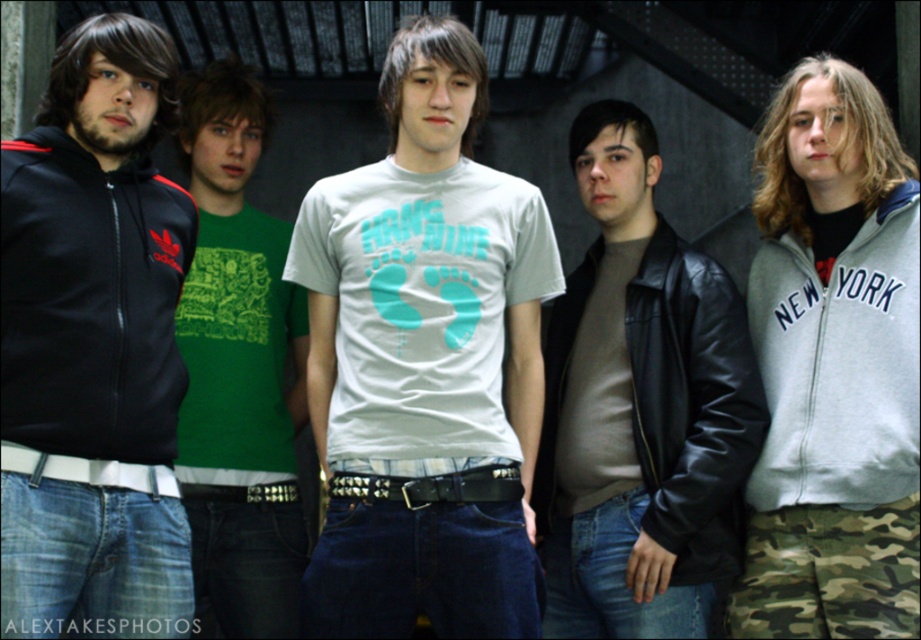
What is located at the coordinates point (92, 346)?

The point (92, 346) is occupied by the matte black hoodie at left.

You are standing in the industrial setting and see the point at coordinates (x=581, y=188). Is this point within a 30 meter safety zone from your current position?

The point at coordinates (x=581, y=188) is 31.76 meters away from the viewer, so it is outside the 30 meter safety zone.

You are observing a group of people in an industrial setting. You notice two items of clothing, the matte black hoodie at left and the black leather jacket at center. Which clothing item appears shorter in height?

The matte black hoodie at left is not as tall as the black leather jacket at center, so the matte black hoodie at left appears shorter in height.